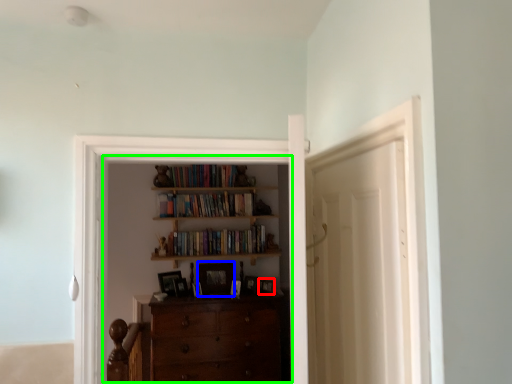
Question: Which object is the farthest from picture frame (highlighted by a red box)? Choose among these: picture frame (highlighted by a blue box) or entertainment center (highlighted by a green box).

Choices:
 (A) picture frame
 (B) entertainment center

Answer: (B)